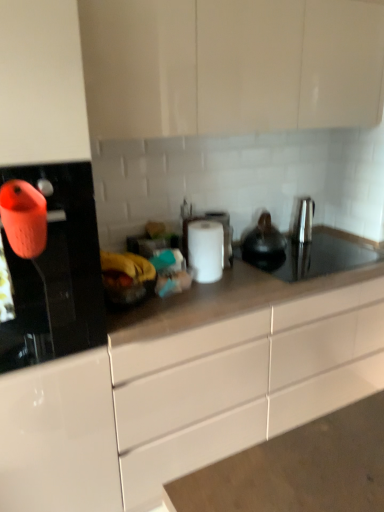
Question: From a real-world perspective, is white matte paper towel at center above or below matte white cabinets at upper center, the 1th cabinetry from the top?

Choices:
 (A) below
 (B) above

Answer: (A)

Question: Based on their positions, is white matte paper towel at center located to the left or right of matte white cabinets at upper center, arranged as the 2th cabinetry when ordered from the bottom?

Choices:
 (A) right
 (B) left

Answer: (B)

Question: Based on their relative distances, which object is nearer to the white glossy cabinet at center, marked as the first cabinetry in a bottom-to-top arrangement?

Choices:
 (A) orange matte kettle at left
 (B) black matte tea pot at center
 (C) white matte paper towel at center
 (D) satin nickel faucet at right
 (E) matte white cabinets at upper center, the 1th cabinetry from the top

Answer: (C)

Question: Estimate the real-world distances between objects in this image. Which object is closer to the matte white cabinets at upper center, arranged as the 2th cabinetry when ordered from the bottom?

Choices:
 (A) white matte paper towel at center
 (B) satin nickel faucet at right
 (C) white glossy cabinet at center, marked as the first cabinetry in a bottom-to-top arrangement
 (D) black matte tea pot at center
 (E) orange matte kettle at left

Answer: (A)